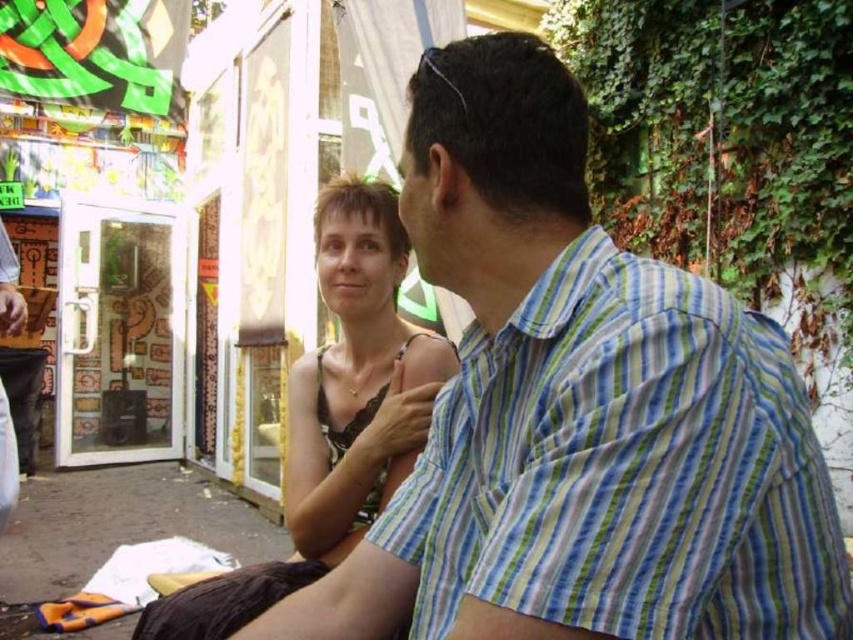
Question: Is striped cotton shirt at upper right to the left of matte black dress at center from the viewer's perspective?

Choices:
 (A) no
 (B) yes

Answer: (A)

Question: Which of the following is the farthest from the observer?

Choices:
 (A) matte black dress at center
 (B) black lace dress at center

Answer: (A)

Question: Which of the following is the farthest from the observer?

Choices:
 (A) (727, 531)
 (B) (312, 360)

Answer: (B)

Question: Which point appears farthest from the camera in this image?

Choices:
 (A) (376, 241)
 (B) (543, 589)
 (C) (300, 435)

Answer: (A)

Question: Can you confirm if striped cotton shirt at upper right is thinner than black lace dress at center?

Choices:
 (A) yes
 (B) no

Answer: (A)

Question: Is the position of black lace dress at center more distant than that of matte black dress at center?

Choices:
 (A) yes
 (B) no

Answer: (B)